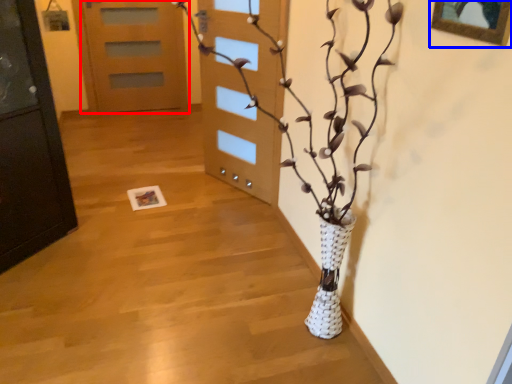
Question: Which object is further to the camera taking this photo, door (highlighted by a red box) or picture frame (highlighted by a blue box)?

Choices:
 (A) door
 (B) picture frame

Answer: (A)